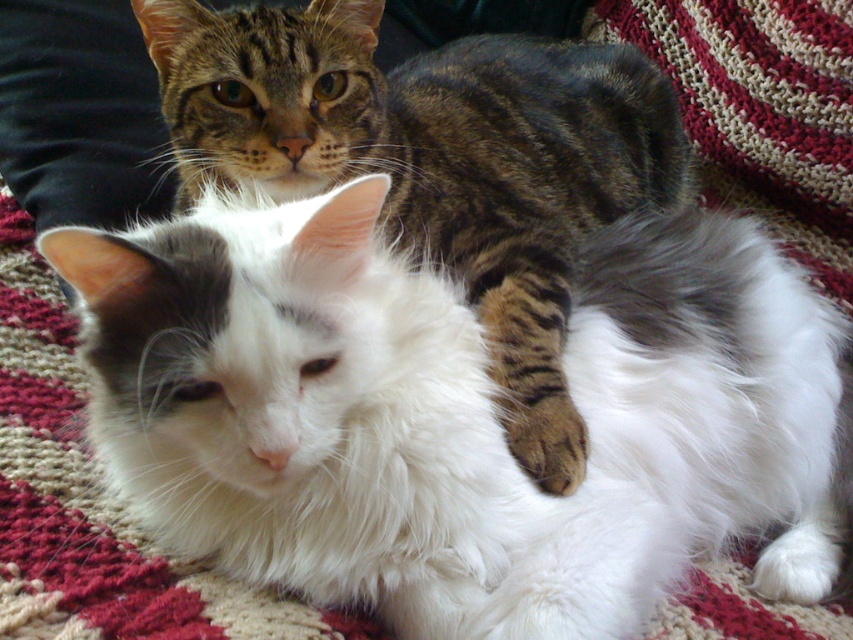
Can you confirm if tabby fur cat at upper center is bigger than white fluffy cat at center?

No, tabby fur cat at upper center is not bigger than white fluffy cat at center.

Is tabby fur cat at upper center wider than white fluffy cat at center?

Yes.

What do you see at coordinates (457, 416) in the screenshot? I see `tabby fur cat at upper center` at bounding box center [457, 416].

The height and width of the screenshot is (640, 853). What are the coordinates of `tabby fur cat at upper center` in the screenshot? It's located at (457, 416).